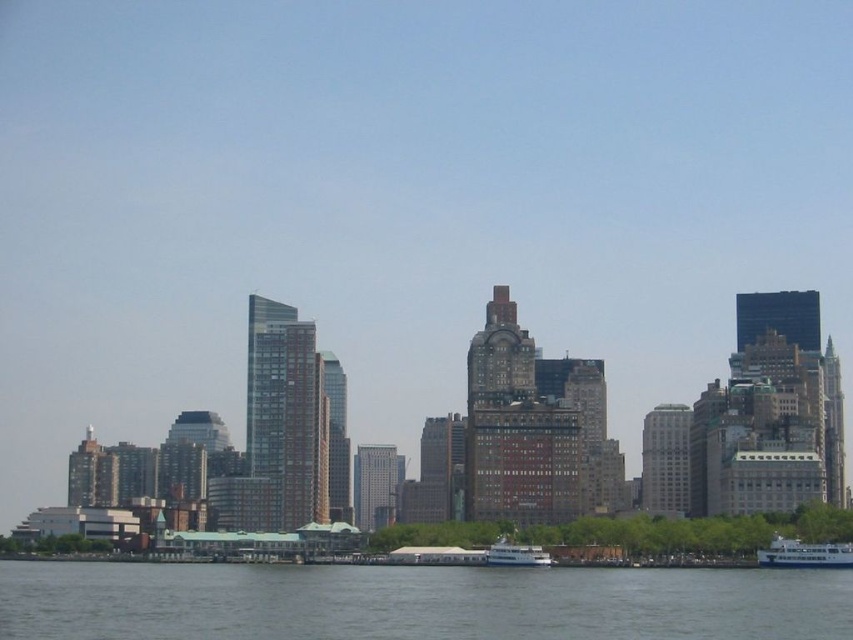
Question: Is the position of white glossy boat at lower right less distant than that of white glossy boat at lower center?

Choices:
 (A) yes
 (B) no

Answer: (B)

Question: Which point is closer to the camera?

Choices:
 (A) (799, 547)
 (B) (683, 600)

Answer: (B)

Question: Is gray water at lower center to the right of white glossy boat at lower center from the viewer's perspective?

Choices:
 (A) no
 (B) yes

Answer: (A)

Question: Estimate the real-world distances between objects in this image. Which object is closer to the gray water at lower center?

Choices:
 (A) white glossy boat at lower center
 (B) white glossy boat at lower right

Answer: (A)

Question: Which object appears farthest from the camera in this image?

Choices:
 (A) white glossy boat at lower right
 (B) white glossy boat at lower center

Answer: (A)

Question: Considering the relative positions of white glossy boat at lower right and white glossy boat at lower center in the image provided, where is white glossy boat at lower right located with respect to white glossy boat at lower center?

Choices:
 (A) above
 (B) below

Answer: (A)